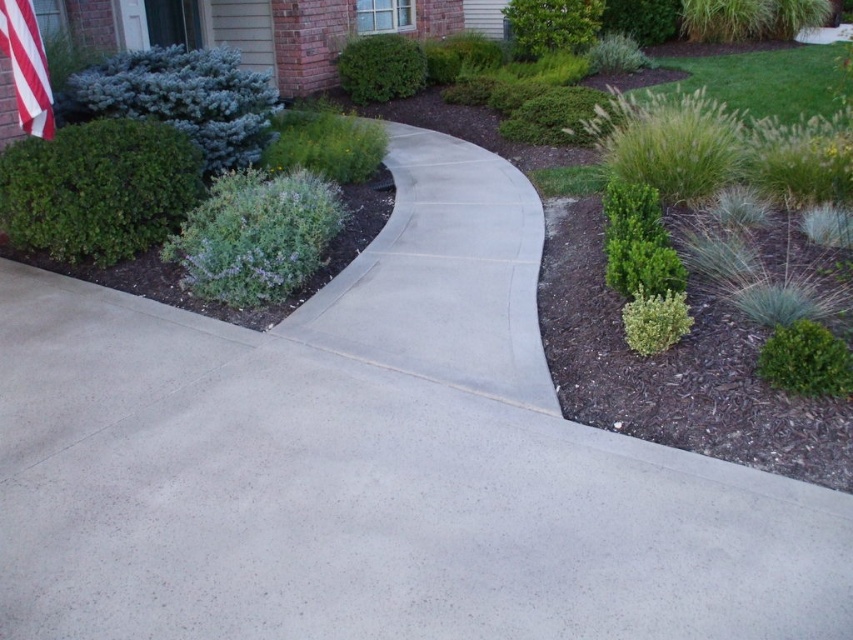
Question: Which point is farther from the camera taking this photo?

Choices:
 (A) (22, 113)
 (B) (402, 93)

Answer: (B)

Question: Where is green matte shrub at upper left located in relation to red and white striped flag at upper left in the image?

Choices:
 (A) right
 (B) left

Answer: (A)

Question: Estimate the real-world distances between objects in this image. Which object is farther from the green leafy shrub at upper center?

Choices:
 (A) red and white striped flag at upper left
 (B) blue-green textured shrub at upper left
 (C) green matte bush at upper center
 (D) green matte shrub at upper left

Answer: (A)

Question: Estimate the real-world distances between objects in this image. Which object is closer to the green leafy shrub at upper center?

Choices:
 (A) red and white striped flag at upper left
 (B) blue-green textured shrub at upper left
 (C) green matte bush at upper center
 (D) green matte shrub at upper left

Answer: (C)

Question: Is the position of green matte shrub at upper left more distant than that of green leafy shrub at upper center?

Choices:
 (A) yes
 (B) no

Answer: (B)

Question: Can you confirm if blue-green textured shrub at upper left is bigger than green matte bush at upper center?

Choices:
 (A) no
 (B) yes

Answer: (B)